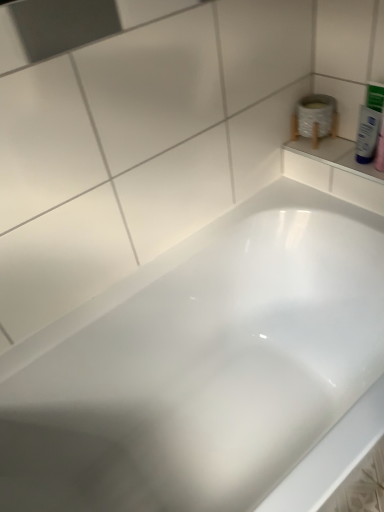
Describe the element at coordinates (201, 365) in the screenshot. I see `white glossy bathtub at center` at that location.

Consider the image. What is the approximate height of white glossy bathtub at center?

The height of white glossy bathtub at center is 21.95 inches.

The height and width of the screenshot is (512, 384). I want to click on white glossy bathtub at center, so click(201, 365).

Find the location of a particular element. white glossy tube at upper right is located at coordinates (369, 123).

The image size is (384, 512). What do you see at coordinates (369, 123) in the screenshot?
I see `white glossy tube at upper right` at bounding box center [369, 123].

The width and height of the screenshot is (384, 512). I want to click on white glossy bathtub at center, so click(201, 365).

Between white glossy bathtub at center and white glossy tube at upper right, which one appears on the right side from the viewer's perspective?

From the viewer's perspective, white glossy tube at upper right appears more on the right side.

In the image, is white glossy bathtub at center positioned in front of or behind white glossy tube at upper right?

Visually, white glossy bathtub at center is located in front of white glossy tube at upper right.

Which is in front, point (3, 404) or point (363, 109)?

The point (3, 404) is closer.

From the image's perspective, who appears lower, white glossy bathtub at center or white glossy tube at upper right?

white glossy bathtub at center.

From a real-world perspective, does white glossy bathtub at center stand above white glossy tube at upper right?

No.

Between white glossy bathtub at center and white glossy tube at upper right, which one has larger width?

Wider between the two is white glossy bathtub at center.

Does white glossy bathtub at center have a greater height compared to white glossy tube at upper right?

Yes, white glossy bathtub at center is taller than white glossy tube at upper right.

Considering the sizes of objects white glossy bathtub at center and white glossy tube at upper right in the image provided, who is bigger, white glossy bathtub at center or white glossy tube at upper right?

Bigger between the two is white glossy bathtub at center.

Is white glossy bathtub at center surrounding white glossy tube at upper right?

No, white glossy tube at upper right is not inside white glossy bathtub at center.

Is white glossy bathtub at center directly adjacent to white glossy tube at upper right?

white glossy bathtub at center and white glossy tube at upper right are clearly separated.

Is white glossy bathtub at center facing towards white glossy tube at upper right?

No, white glossy bathtub at center is not facing towards white glossy tube at upper right.

Can you tell me how much white glossy bathtub at center and white glossy tube at upper right differ in facing direction?

The facing directions of white glossy bathtub at center and white glossy tube at upper right are 90.1 degrees apart.

Find the location of a particular element. This screenshot has height=512, width=384. bathtub lying in front of the white glossy tube at upper right is located at coordinates (201, 365).

Is white glossy tube at upper right to the left of white glossy bathtub at center from the viewer's perspective?

No.

In the scene shown: Considering the positions of objects white glossy tube at upper right and white glossy bathtub at center in the image provided, who is behind, white glossy tube at upper right or white glossy bathtub at center?

white glossy tube at upper right is more distant.

Does point (363, 163) come behind point (112, 365)?

Yes, point (363, 163) is farther from viewer.

From the image's perspective, is white glossy tube at upper right below white glossy bathtub at center?

Actually, white glossy tube at upper right appears above white glossy bathtub at center in the image.

From a real-world perspective, who is located higher, white glossy tube at upper right or white glossy bathtub at center?

white glossy tube at upper right is physically above.

Which object is wider, white glossy tube at upper right or white glossy bathtub at center?

white glossy bathtub at center is wider.

Considering the relative sizes of white glossy tube at upper right and white glossy bathtub at center in the image provided, is white glossy tube at upper right taller than white glossy bathtub at center?

No.

Is white glossy tube at upper right bigger than white glossy bathtub at center?

Actually, white glossy tube at upper right might be smaller than white glossy bathtub at center.

Is white glossy tube at upper right inside the boundaries of white glossy bathtub at center, or outside?

white glossy tube at upper right lies outside white glossy bathtub at center.

Does white glossy tube at upper right touch white glossy bathtub at center?

No, white glossy tube at upper right is not beside white glossy bathtub at center.

Is white glossy tube at upper right looking in the opposite direction of white glossy bathtub at center?

No, white glossy bathtub at center is not at the back of white glossy tube at upper right.

Can you tell me how much white glossy tube at upper right and white glossy bathtub at center differ in facing direction?

white glossy tube at upper right and white glossy bathtub at center are facing 90.1 degrees away from each other.

Locate an element on the screen. Image resolution: width=384 pixels, height=512 pixels. mouthwash behind the white glossy bathtub at center is located at coordinates (369, 123).

Where is `mouthwash behind the white glossy bathtub at center`? The height and width of the screenshot is (512, 384). mouthwash behind the white glossy bathtub at center is located at coordinates (369, 123).

Where is `bathtub in front of the white glossy tube at upper right`? The width and height of the screenshot is (384, 512). bathtub in front of the white glossy tube at upper right is located at coordinates (201, 365).